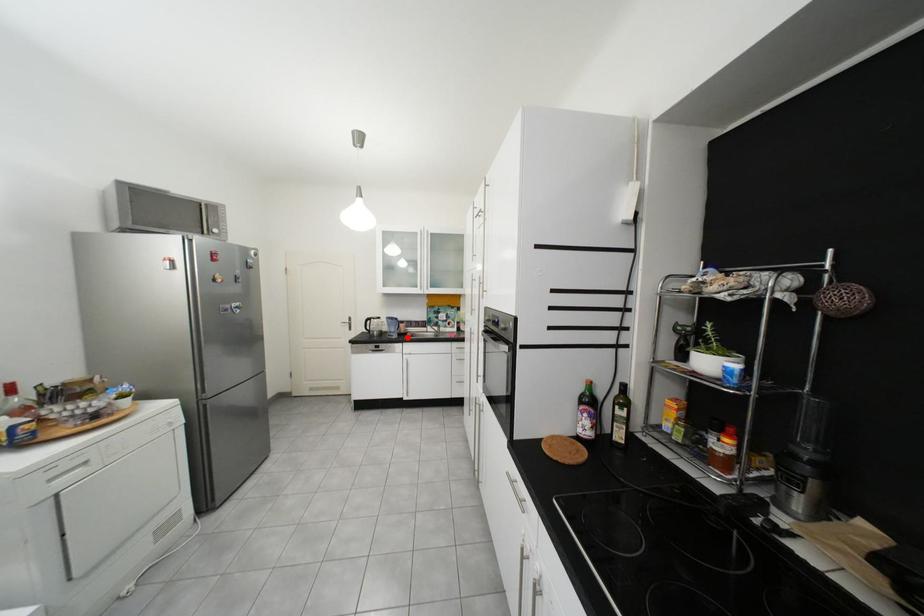
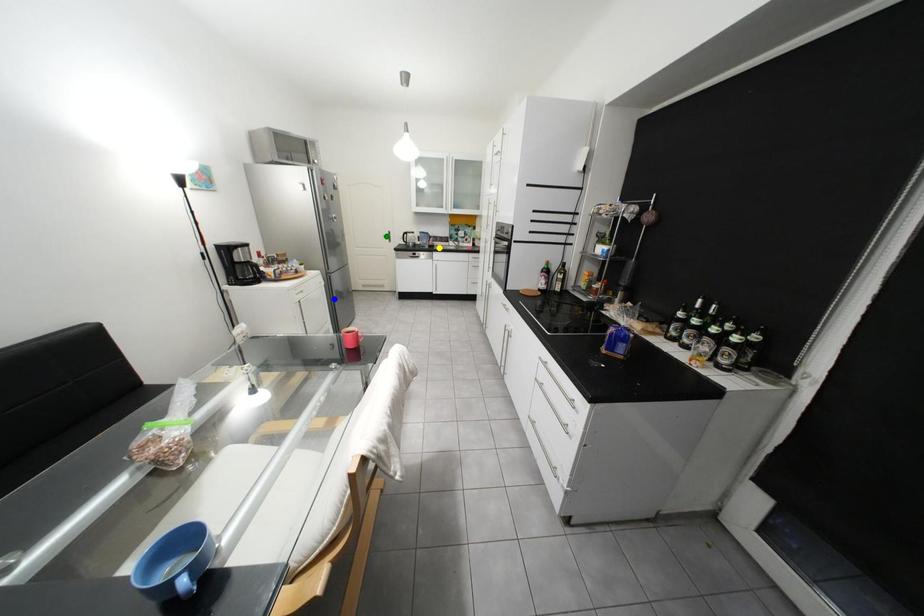
Question: I am providing you with two images of the same scene from different viewpoints. A red point is marked on the first image. You are given multiple points on the second image. In image 2, which mark is for the same physical point as the one in image 1?

Choices:
 (A) green point
 (B) blue point
 (C) yellow point

Answer: (C)